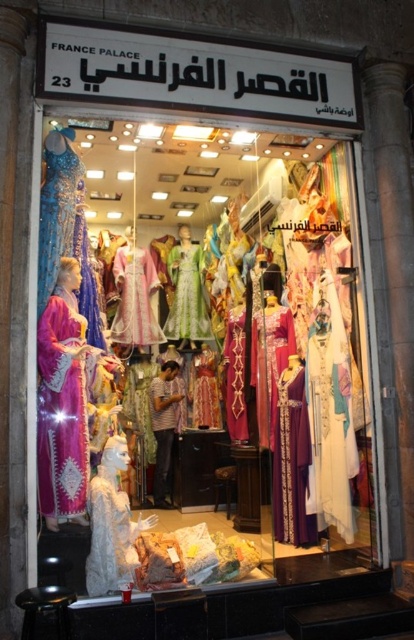
You are a customer looking to buy a dress for a formal event. You see the matte purple dress at center and the green lace dress at center in the display window. Which dress would you choose if you prefer a more voluminous option?

The matte purple dress at center is larger in size than the green lace dress at center, so you should choose the matte purple dress at center for a more voluminous option.

You are a customer standing outside the France Palace shop looking through the display window. You see the matte purple dress at center and the shiny blue fabric dress at left. Which dress is closer to you?

The matte purple dress at center is closer to you because it is further to the viewer than the shiny blue fabric dress at left.

You are a customer looking at the display window of France Palace. You see the shiny blue fabric dress at left and the green lace dress at center. Which dress is positioned higher in the display window?

The shiny blue fabric dress at left is located above the green lace dress at center, so it is positioned higher in the display window.